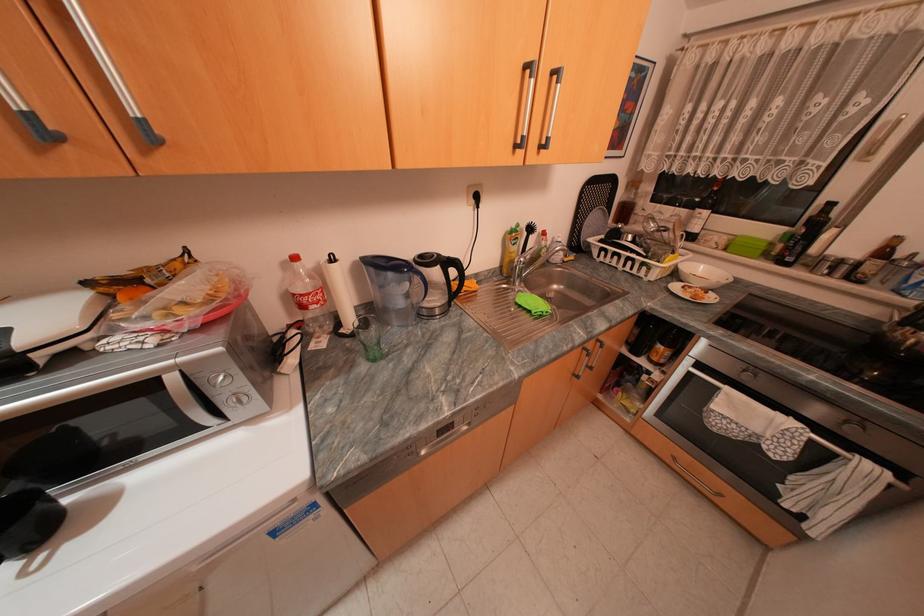
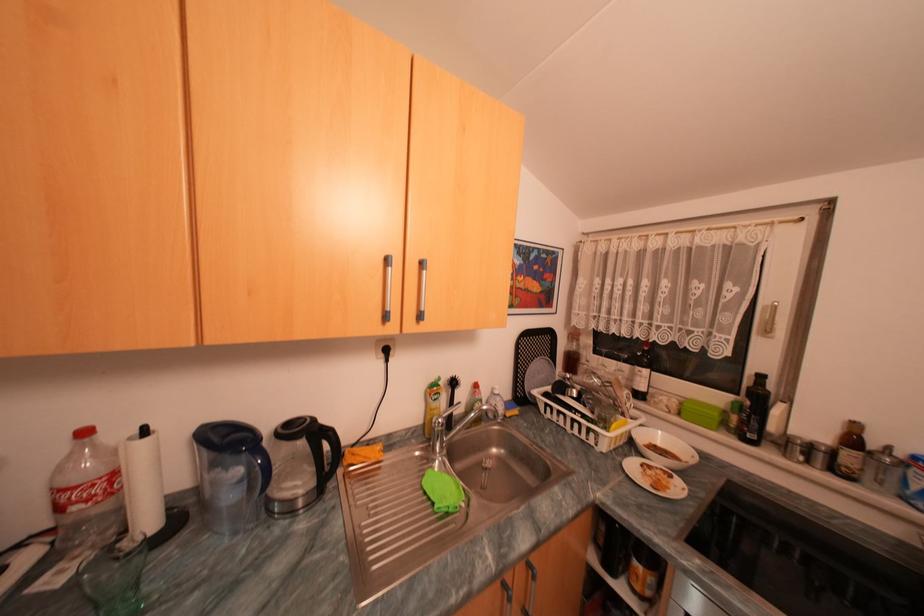
Where in the second image is the point corresponding to the point at 894,253 from the first image?

(862, 440)